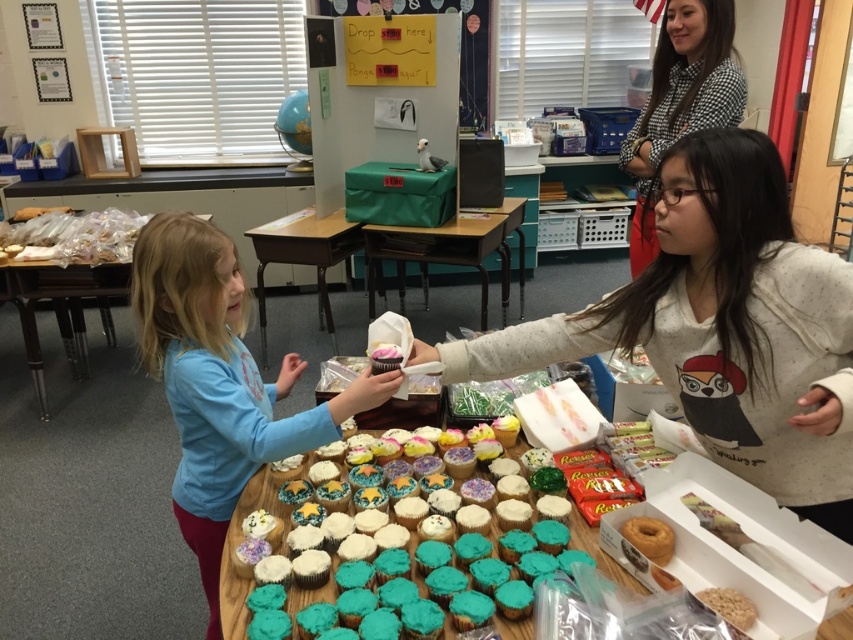
Question: Among these objects, which one is nearest to the camera?

Choices:
 (A) green fabric table at center
 (B) pink frosted cupcake at center
 (C) white cardboard table at center
 (D) plaid shirt at upper right

Answer: (B)

Question: Is white speckled hoodie at center behind pink frosted cupcake at center?

Choices:
 (A) yes
 (B) no

Answer: (B)

Question: Is plaid shirt at upper right bigger than clear plastic bag at left?

Choices:
 (A) no
 (B) yes

Answer: (A)

Question: Can you confirm if matte blue shirt at center is positioned to the right of pink frosted cupcake at center?

Choices:
 (A) no
 (B) yes

Answer: (A)

Question: Which object is positioned closest to the plaid shirt at upper right?

Choices:
 (A) clear plastic bag at left
 (B) white speckled hoodie at center
 (C) pink frosted cupcake at center
 (D) matte blue shirt at center

Answer: (B)

Question: Based on their relative distances, which object is nearer to the matte blue shirt at center?

Choices:
 (A) pink frosted cupcake at center
 (B) white speckled hoodie at center
 (C) green fabric table at center
 (D) plaid shirt at upper right

Answer: (A)